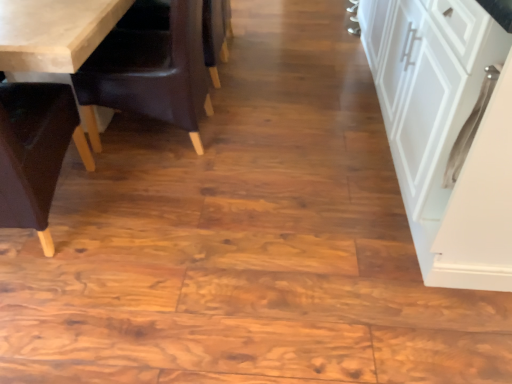
Locate an element on the screen. Image resolution: width=512 pixels, height=384 pixels. free region under brown leather chair at left, placed as the 1th chair when sorted from right to left (from a real-world perspective) is located at coordinates (185, 140).